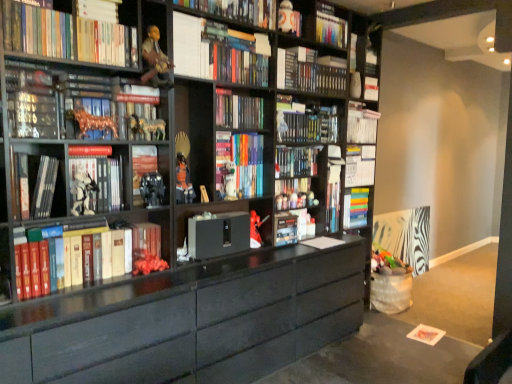
Locate an element on the screen. free location above matte black figurine at upper left, the seventh book positioned from the top (from a real-world perspective) is located at coordinates (85, 72).